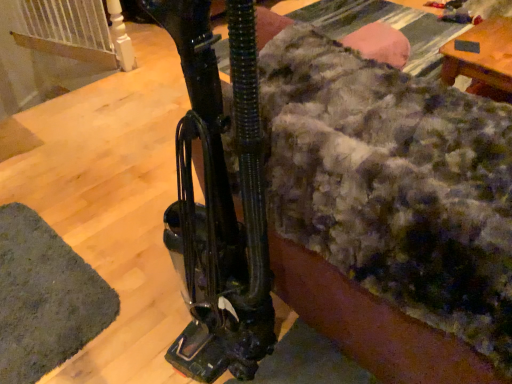
The height and width of the screenshot is (384, 512). Describe the element at coordinates (393, 184) in the screenshot. I see `fuzzy woolen blanket at center` at that location.

The image size is (512, 384). In order to click on fuzzy woolen blanket at center in this screenshot , I will do `click(393, 184)`.

Describe the element at coordinates (45, 298) in the screenshot. I see `green fuzzy mat at lower left` at that location.

This screenshot has width=512, height=384. What are the coordinates of `green fuzzy mat at lower left` in the screenshot? It's located at (45, 298).

Image resolution: width=512 pixels, height=384 pixels. Find the location of `fuzzy woolen blanket at center`. fuzzy woolen blanket at center is located at coordinates (393, 184).

In the image, is fuzzy woolen blanket at center on the left side or the right side of green fuzzy mat at lower left?

In the image, fuzzy woolen blanket at center appears on the right side of green fuzzy mat at lower left.

Considering the relative positions of fuzzy woolen blanket at center and green fuzzy mat at lower left in the image provided, is fuzzy woolen blanket at center behind green fuzzy mat at lower left?

No, it is in front of green fuzzy mat at lower left.

Which is less distant, (465, 139) or (69, 324)?

The point (465, 139) is in front.

From the image's perspective, relative to green fuzzy mat at lower left, is fuzzy woolen blanket at center above or below?

From the image's perspective, fuzzy woolen blanket at center appears above green fuzzy mat at lower left.

From a real-world perspective, is fuzzy woolen blanket at center positioned above or below green fuzzy mat at lower left?

From a real-world perspective, fuzzy woolen blanket at center is physically above green fuzzy mat at lower left.

Which object is wider, fuzzy woolen blanket at center or green fuzzy mat at lower left?

fuzzy woolen blanket at center is wider.

From the picture: Considering the relative sizes of fuzzy woolen blanket at center and green fuzzy mat at lower left in the image provided, is fuzzy woolen blanket at center taller than green fuzzy mat at lower left?

Indeed, fuzzy woolen blanket at center has a greater height compared to green fuzzy mat at lower left.

From the picture: Who is smaller, fuzzy woolen blanket at center or green fuzzy mat at lower left?

With smaller size is green fuzzy mat at lower left.

Is green fuzzy mat at lower left surrounded by fuzzy woolen blanket at center?

No, green fuzzy mat at lower left is not a part of fuzzy woolen blanket at center.

Is fuzzy woolen blanket at center next to green fuzzy mat at lower left and touching it?

They are not placed beside each other.

Does fuzzy woolen blanket at center turn towards green fuzzy mat at lower left?

No, fuzzy woolen blanket at center is not turned towards green fuzzy mat at lower left.

What's the angular difference between fuzzy woolen blanket at center and green fuzzy mat at lower left's facing directions?

They differ by 87.1 degrees in their facing directions.

Identify the location of mat directly beneath the fuzzy woolen blanket at center (from a real-world perspective). (45, 298).

Which object is positioned more to the left, green fuzzy mat at lower left or fuzzy woolen blanket at center?

green fuzzy mat at lower left is more to the left.

Between green fuzzy mat at lower left and fuzzy woolen blanket at center, which one is positioned in front?

fuzzy woolen blanket at center is in front.

Which point is more forward, (23, 219) or (508, 122)?

Positioned in front is point (508, 122).

Based on the photo, from the image's perspective, is green fuzzy mat at lower left positioned above or below fuzzy woolen blanket at center?

Clearly, from the image's perspective, green fuzzy mat at lower left is below fuzzy woolen blanket at center.

From a real-world perspective, which object stands above the other?

fuzzy woolen blanket at center.

Can you confirm if green fuzzy mat at lower left is wider than fuzzy woolen blanket at center?

In fact, green fuzzy mat at lower left might be narrower than fuzzy woolen blanket at center.

From the picture: In terms of height, does green fuzzy mat at lower left look taller or shorter compared to fuzzy woolen blanket at center?

In the image, green fuzzy mat at lower left appears to be shorter than fuzzy woolen blanket at center.

Does green fuzzy mat at lower left have a smaller size compared to fuzzy woolen blanket at center?

Correct, green fuzzy mat at lower left occupies less space than fuzzy woolen blanket at center.

Is fuzzy woolen blanket at center a part of green fuzzy mat at lower left?

No, fuzzy woolen blanket at center is not surrounded by green fuzzy mat at lower left.

From the picture: Is green fuzzy mat at lower left beside fuzzy woolen blanket at center?

No, green fuzzy mat at lower left is not in contact with fuzzy woolen blanket at center.

Is green fuzzy mat at lower left looking in the opposite direction of fuzzy woolen blanket at center?

No, green fuzzy mat at lower left is not facing the opposite direction of fuzzy woolen blanket at center.

What's the angular difference between green fuzzy mat at lower left and fuzzy woolen blanket at center's facing directions?

87.1 degrees separate the facing orientations of green fuzzy mat at lower left and fuzzy woolen blanket at center.

Measure the distance between green fuzzy mat at lower left and fuzzy woolen blanket at center.

green fuzzy mat at lower left and fuzzy woolen blanket at center are 3.29 feet apart.

In order to click on blanket that is above the green fuzzy mat at lower left (from a real-world perspective) in this screenshot , I will do `click(393, 184)`.

Identify the location of blanket located on the right of green fuzzy mat at lower left. (393, 184).

Locate an element on the screen. mat below the fuzzy woolen blanket at center (from the image's perspective) is located at coordinates (45, 298).